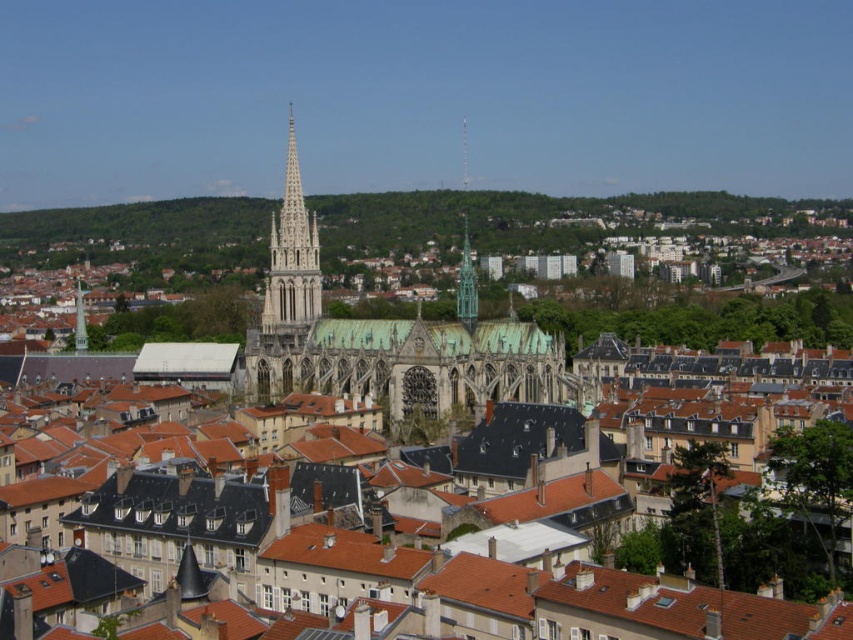
Question: Is white stone spire at center wider than green glass spire at center?

Choices:
 (A) yes
 (B) no

Answer: (A)

Question: Which of the following is the closest to the observer?

Choices:
 (A) (541, 353)
 (B) (292, 125)

Answer: (A)

Question: Which of these objects is positioned farthest from the white stone spire at center?

Choices:
 (A) green copper roof at center
 (B) green glass spire at center

Answer: (B)

Question: Which object is the farthest from the green copper roof at center?

Choices:
 (A) green glass spire at center
 (B) white stone spire at center

Answer: (A)

Question: Can you confirm if green copper roof at center is positioned above green glass spire at center?

Choices:
 (A) no
 (B) yes

Answer: (B)

Question: Does green copper roof at center have a larger size compared to green glass spire at center?

Choices:
 (A) yes
 (B) no

Answer: (A)